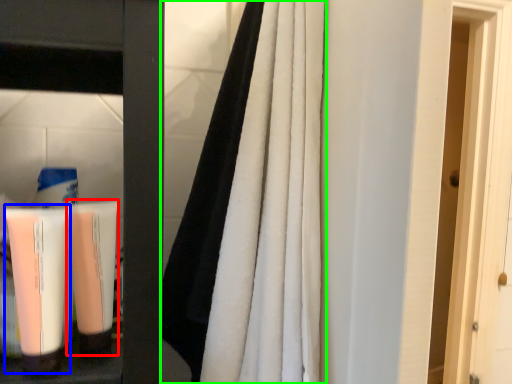
Question: Which object is the farthest from shaving cream (highlighted by a red box)? Choose among these: cleaning product (highlighted by a blue box) or curtain (highlighted by a green box).

Choices:
 (A) cleaning product
 (B) curtain

Answer: (B)